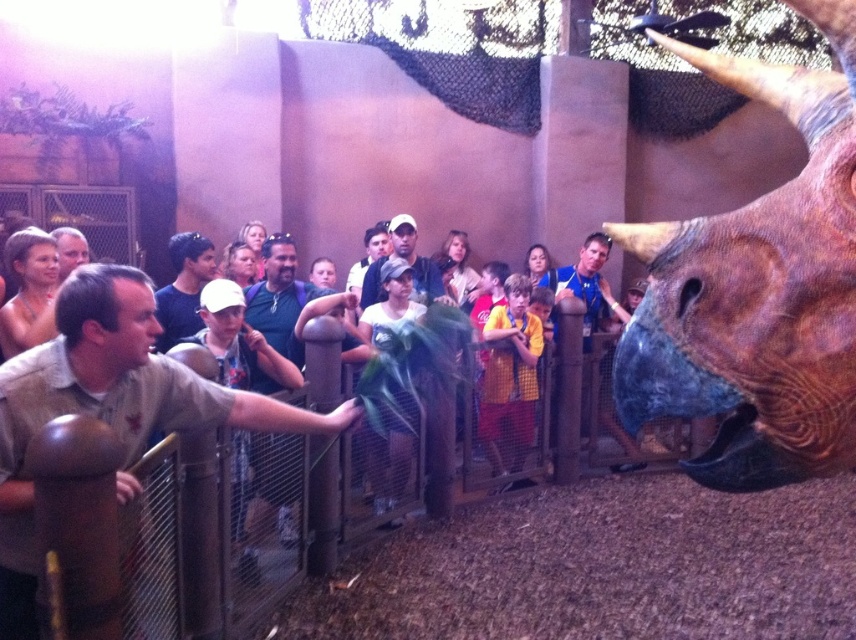
In the scene shown: Between rustic brown horned head at right and yellow shirt at center, which one has more height?

With more height is yellow shirt at center.

Locate an element on the screen. rustic brown horned head at right is located at coordinates (758, 289).

Is light brown shirt at center positioned in front of yellow shirt at center?

Yes, it is.

Does light brown shirt at center have a greater height compared to yellow shirt at center?

No.

Between point (245, 396) and point (495, 428), which one is positioned in front?

Point (245, 396) is more forward.

Identify the location of light brown shirt at center. (108, 406).

Between rustic brown horned head at right and light brown shirt at center, which one has less height?

light brown shirt at center is shorter.

In order to click on rustic brown horned head at right in this screenshot , I will do `click(758, 289)`.